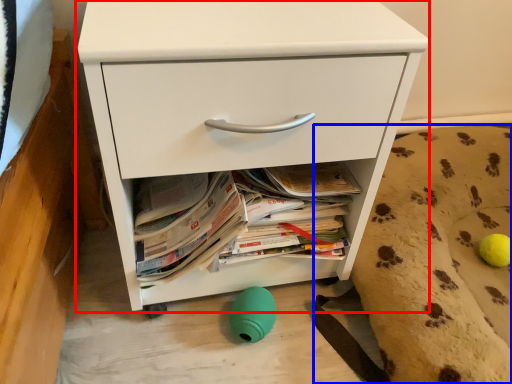
Question: Which object is closer to the camera taking this photo, chest of drawers (highlighted by a red box) or dog bed (highlighted by a blue box)?

Choices:
 (A) chest of drawers
 (B) dog bed

Answer: (A)